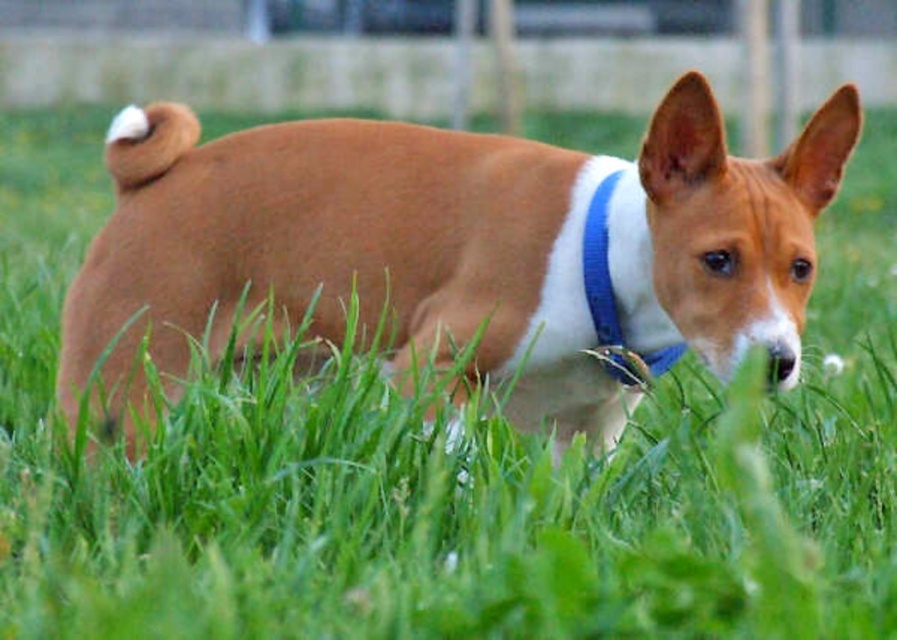
What do you see at coordinates (451, 253) in the screenshot?
I see `brown smooth dog at center` at bounding box center [451, 253].

Is brown smooth dog at center thinner than blue fabric neckband at center?

No, brown smooth dog at center is not thinner than blue fabric neckband at center.

Measure the distance between brown smooth dog at center and camera.

The distance of brown smooth dog at center from camera is 7.27 feet.

The image size is (897, 640). I want to click on brown smooth dog at center, so click(x=451, y=253).